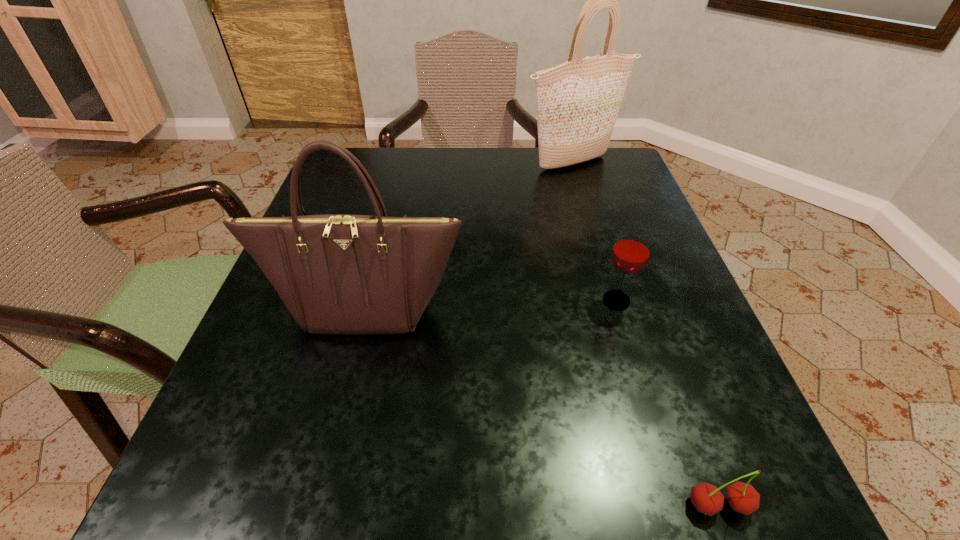
The width and height of the screenshot is (960, 540). In order to click on unoccupied area between the farthest object and the leftmost object in this screenshot , I will do `click(468, 236)`.

The height and width of the screenshot is (540, 960). What are the coordinates of `free space between the nearest object and the leftmost object` in the screenshot? It's located at (542, 407).

Where is `vacant space in between the third shortest object and the glass`? vacant space in between the third shortest object and the glass is located at coordinates (491, 305).

You are a GUI agent. You are given a task and a screenshot of the screen. Output one action in this format:
    pyautogui.click(x=<x>, y=<y>)
    Task: Click on the vacant area between the shortest object and the shopping bag
    The width and height of the screenshot is (960, 540).
    Given the screenshot: What is the action you would take?
    click(645, 334)

You are a GUI agent. You are given a task and a screenshot of the screen. Output one action in this format:
    pyautogui.click(x=<x>, y=<y>)
    Task: Click on the object identified as the closest to the shopping bag
    Image resolution: width=960 pixels, height=540 pixels.
    Given the screenshot: What is the action you would take?
    pyautogui.click(x=631, y=251)

Locate an element on the screen. object that is the third nearest to the leftmost object is located at coordinates (578, 101).

Locate an element on the screen. vacant area in the image that satisfies the following two spatial constraints: 1. on the front side of the shopping bag; 2. on the right side of the glass is located at coordinates (612, 300).